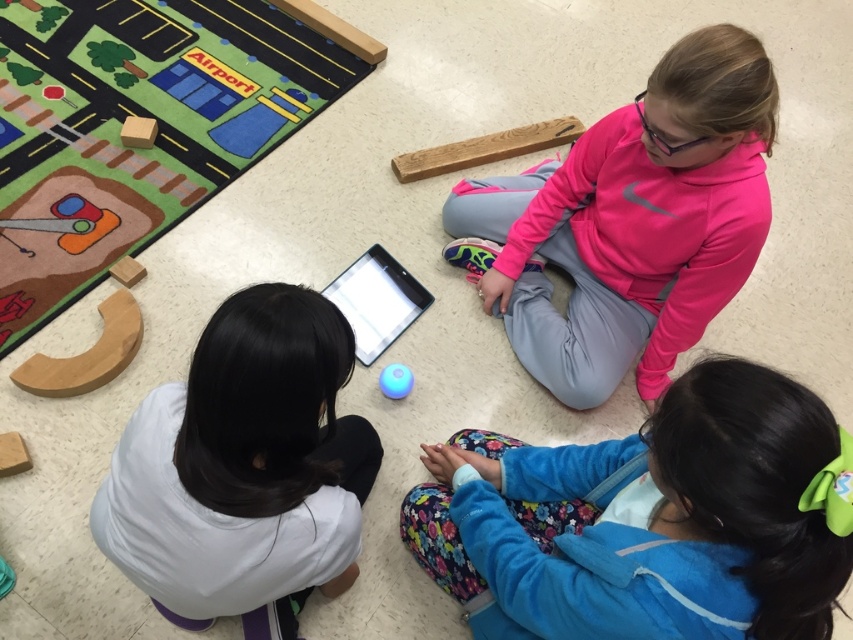
Question: Is blue fleece jacket at lower right bigger than pink fleece sweatshirt at upper right?

Choices:
 (A) yes
 (B) no

Answer: (B)

Question: Considering the real-world distances, which object is closest to the blue rubber ball at center?

Choices:
 (A) pink fleece sweatshirt at upper right
 (B) black glossy tablet at center
 (C) white matte shirt at center
 (D) blue fleece jacket at lower right

Answer: (B)

Question: Is black glossy tablet at center wider than blue rubber ball at center?

Choices:
 (A) no
 (B) yes

Answer: (B)

Question: Estimate the real-world distances between objects in this image. Which object is closer to the white matte shirt at center?

Choices:
 (A) blue rubber ball at center
 (B) pink fleece sweatshirt at upper right

Answer: (A)

Question: Which point appears closest to the camera in this image?

Choices:
 (A) (769, 93)
 (B) (167, 474)
 (C) (374, 250)

Answer: (B)

Question: Is blue fleece jacket at lower right closer to the viewer compared to white matte shirt at center?

Choices:
 (A) no
 (B) yes

Answer: (B)